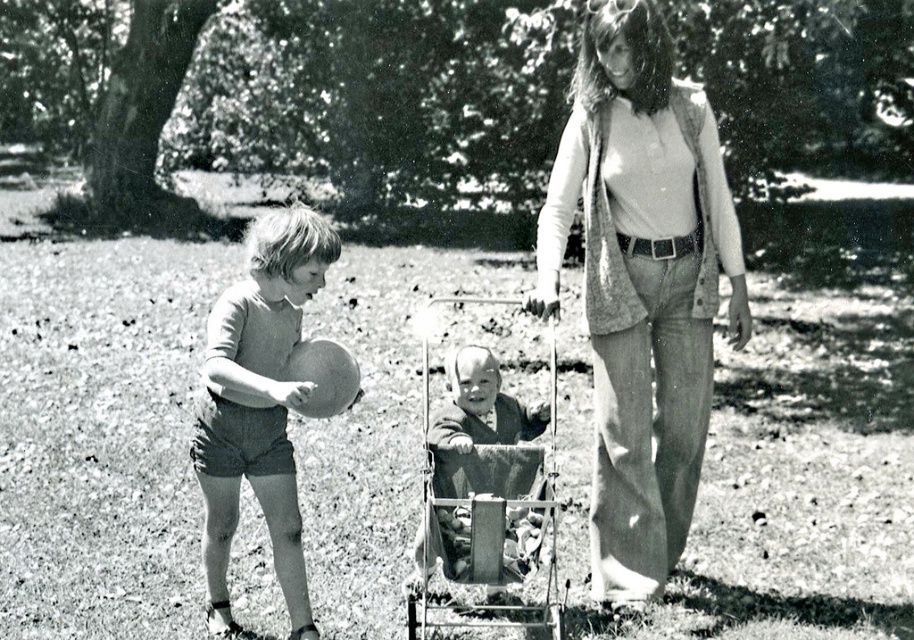
Which is more to the left, knitted sweater at center or metallic silver baby carriage at center?

metallic silver baby carriage at center is more to the left.

Does knitted sweater at center have a larger size compared to metallic silver baby carriage at center?

Yes, knitted sweater at center is bigger than metallic silver baby carriage at center.

The width and height of the screenshot is (914, 640). Identify the location of knitted sweater at center. (643, 284).

Which is behind, point (604, 260) or point (262, 289)?

Positioned behind is point (604, 260).

This screenshot has width=914, height=640. What do you see at coordinates (643, 284) in the screenshot?
I see `knitted sweater at center` at bounding box center [643, 284].

Does point (608, 536) lie behind point (208, 387)?

Yes, point (608, 536) is farther from viewer.

Where is `knitted sweater at center`? The width and height of the screenshot is (914, 640). knitted sweater at center is located at coordinates (643, 284).

Does smooth beige shorts at left have a greater height compared to metallic silver baby carriage at center?

Yes, smooth beige shorts at left is taller than metallic silver baby carriage at center.

Does point (317, 260) lie in front of point (490, 545)?

Yes, it is.

Image resolution: width=914 pixels, height=640 pixels. In order to click on smooth beige shorts at left in this screenshot , I will do `click(258, 404)`.